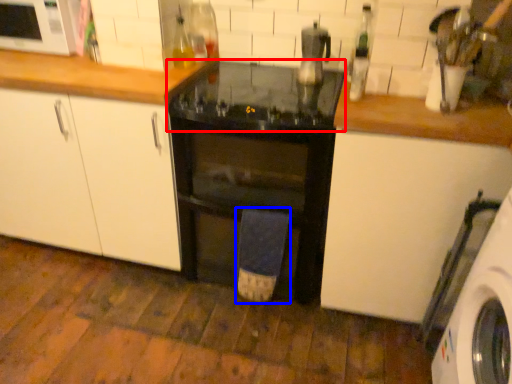
Question: Which point is further to the camera, gas stove (highlighted by a red box) or bath towel (highlighted by a blue box)?

Choices:
 (A) gas stove
 (B) bath towel

Answer: (B)